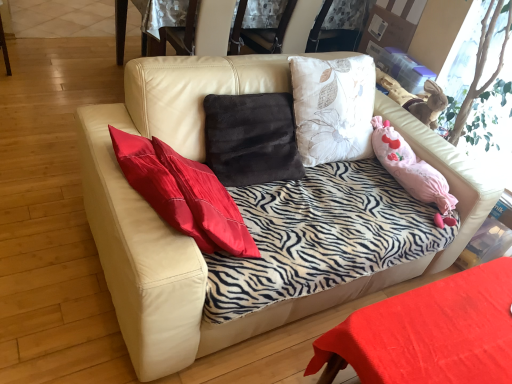
Question: Is leather at upper center wider than smooth red table at lower right?

Choices:
 (A) yes
 (B) no

Answer: (B)

Question: Can you confirm if leather at upper center is thinner than smooth red table at lower right?

Choices:
 (A) no
 (B) yes

Answer: (B)

Question: Is leather at upper center positioned behind smooth red table at lower right?

Choices:
 (A) no
 (B) yes

Answer: (B)

Question: From the image's perspective, is leather at upper center beneath smooth red table at lower right?

Choices:
 (A) no
 (B) yes

Answer: (A)

Question: Is leather at upper center in front of smooth red table at lower right?

Choices:
 (A) yes
 (B) no

Answer: (B)

Question: Is leather at upper center taller than smooth red table at lower right?

Choices:
 (A) no
 (B) yes

Answer: (B)

Question: Considering the relative sizes of smooth red table at lower right and leather at upper center in the image provided, is smooth red table at lower right wider than leather at upper center?

Choices:
 (A) yes
 (B) no

Answer: (A)

Question: Considering the relative sizes of smooth red table at lower right and leather at upper center in the image provided, is smooth red table at lower right taller than leather at upper center?

Choices:
 (A) yes
 (B) no

Answer: (B)

Question: Does smooth red table at lower right have a lesser width compared to leather at upper center?

Choices:
 (A) no
 (B) yes

Answer: (A)

Question: Is smooth red table at lower right outside leather at upper center?

Choices:
 (A) no
 (B) yes

Answer: (B)

Question: Considering the relative positions of smooth red table at lower right and leather at upper center in the image provided, is smooth red table at lower right to the right of leather at upper center from the viewer's perspective?

Choices:
 (A) no
 (B) yes

Answer: (B)

Question: From the image's perspective, is smooth red table at lower right located beneath leather at upper center?

Choices:
 (A) yes
 (B) no

Answer: (A)

Question: From a real-world perspective, is smooth red table at lower right on top of leather couch at center?

Choices:
 (A) yes
 (B) no

Answer: (B)